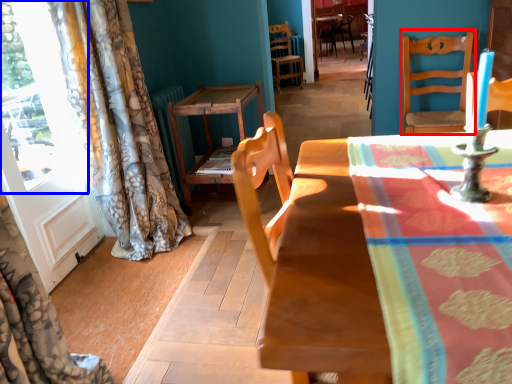
Question: Which of the following is the farthest to the observer, chair (highlighted by a red box) or window (highlighted by a blue box)?

Choices:
 (A) chair
 (B) window

Answer: (A)